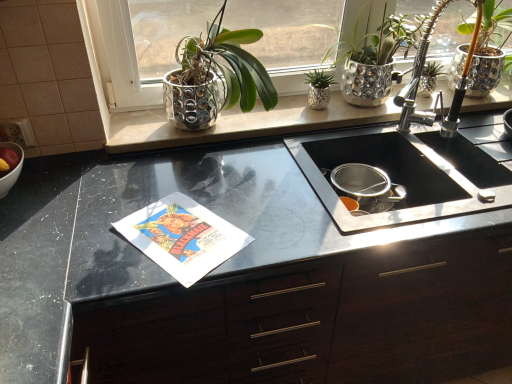
Question: Can you confirm if satin nickel faucet at upper right is shorter than black matte cabinet at center?

Choices:
 (A) no
 (B) yes

Answer: (B)

Question: Can you confirm if satin nickel faucet at upper right is taller than black matte cabinet at center?

Choices:
 (A) yes
 (B) no

Answer: (B)

Question: Considering the relative positions of satin nickel faucet at upper right and black matte cabinet at center in the image provided, is satin nickel faucet at upper right behind black matte cabinet at center?

Choices:
 (A) no
 (B) yes

Answer: (B)

Question: Is satin nickel faucet at upper right bigger than black matte cabinet at center?

Choices:
 (A) no
 (B) yes

Answer: (A)

Question: Is the depth of satin nickel faucet at upper right less than that of black matte cabinet at center?

Choices:
 (A) yes
 (B) no

Answer: (B)

Question: Considering the positions of shiny metallic pot at upper center, positioned as the 1th houseplant in left-to-right order, and white glossy bowl at left in the image, is shiny metallic pot at upper center, positioned as the 1th houseplant in left-to-right order, taller or shorter than white glossy bowl at left?

Choices:
 (A) tall
 (B) short

Answer: (A)

Question: Visually, is shiny metallic pot at upper center, which is the 3th houseplant in right-to-left order, positioned to the left or to the right of white glossy bowl at left?

Choices:
 (A) right
 (B) left

Answer: (A)

Question: Looking at their shapes, would you say shiny metallic pot at upper center, positioned as the 1th houseplant in left-to-right order, is wider or thinner than white glossy bowl at left?

Choices:
 (A) wide
 (B) thin

Answer: (A)

Question: In the image, is shiny metallic pot at upper center, positioned as the 1th houseplant in left-to-right order, positioned in front of or behind white glossy bowl at left?

Choices:
 (A) front
 (B) behind

Answer: (B)

Question: From a real-world perspective, is green metallic pot at upper center, marked as the second houseplant in a right-to-left arrangement, above or below satin nickel faucet at upper right?

Choices:
 (A) above
 (B) below

Answer: (B)

Question: Considering the positions of point (323, 84) and point (437, 13), is point (323, 84) closer or farther from the camera than point (437, 13)?

Choices:
 (A) closer
 (B) farther

Answer: (B)

Question: Visually, is green metallic pot at upper center, marked as the second houseplant in a right-to-left arrangement, positioned to the left or to the right of satin nickel faucet at upper right?

Choices:
 (A) right
 (B) left

Answer: (B)

Question: Looking at their shapes, would you say green metallic pot at upper center, marked as the second houseplant in a right-to-left arrangement, is wider or thinner than satin nickel faucet at upper right?

Choices:
 (A) thin
 (B) wide

Answer: (A)

Question: From the image's perspective, is satin nickel faucet at upper right above or below shiny metallic pot at upper right, which is the first houseplant in right-to-left order?

Choices:
 (A) below
 (B) above

Answer: (A)

Question: In terms of width, does satin nickel faucet at upper right look wider or thinner when compared to shiny metallic pot at upper right, which ranks as the 3th houseplant in left-to-right order?

Choices:
 (A) thin
 (B) wide

Answer: (B)